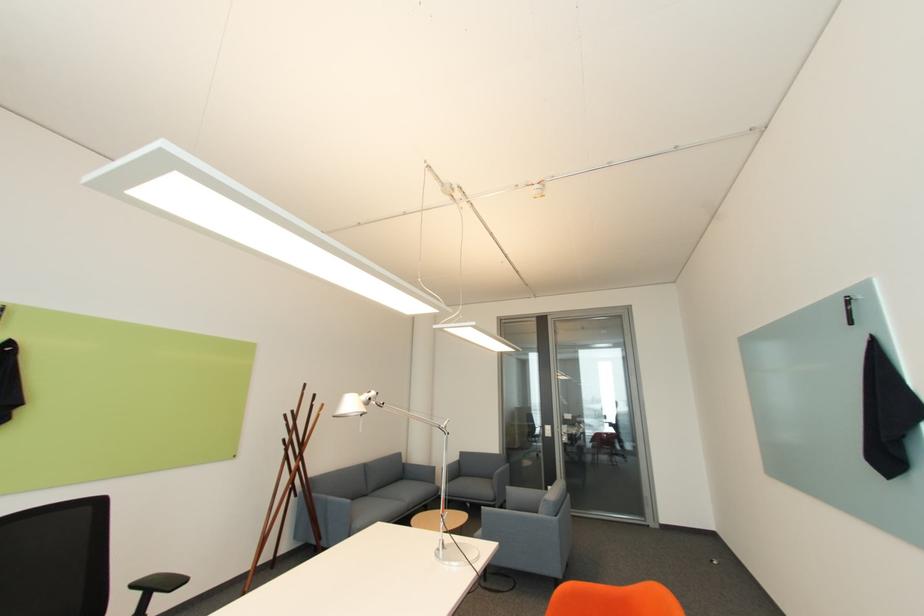
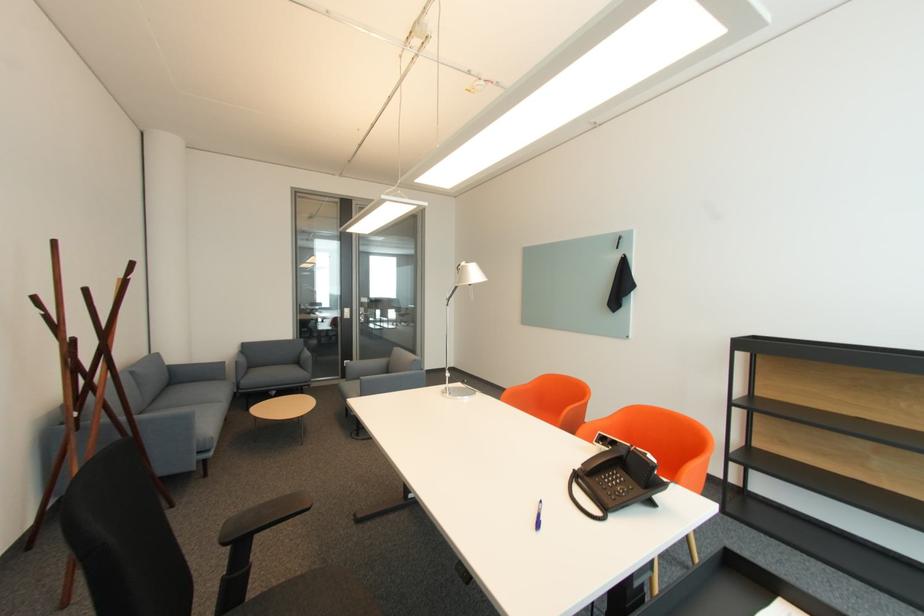
The point at (x=295, y=424) is marked in the first image. Where is the corresponding point in the second image?

(53, 315)